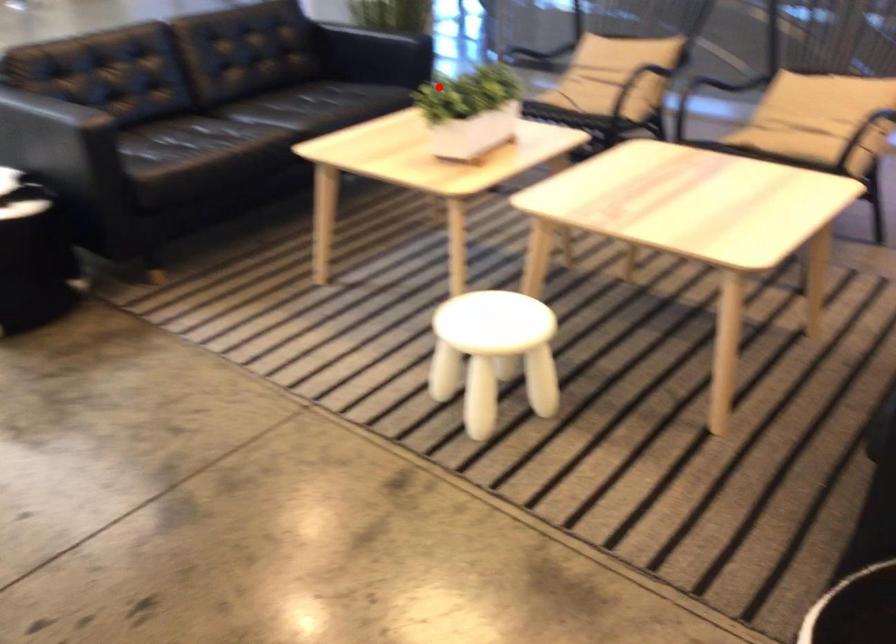
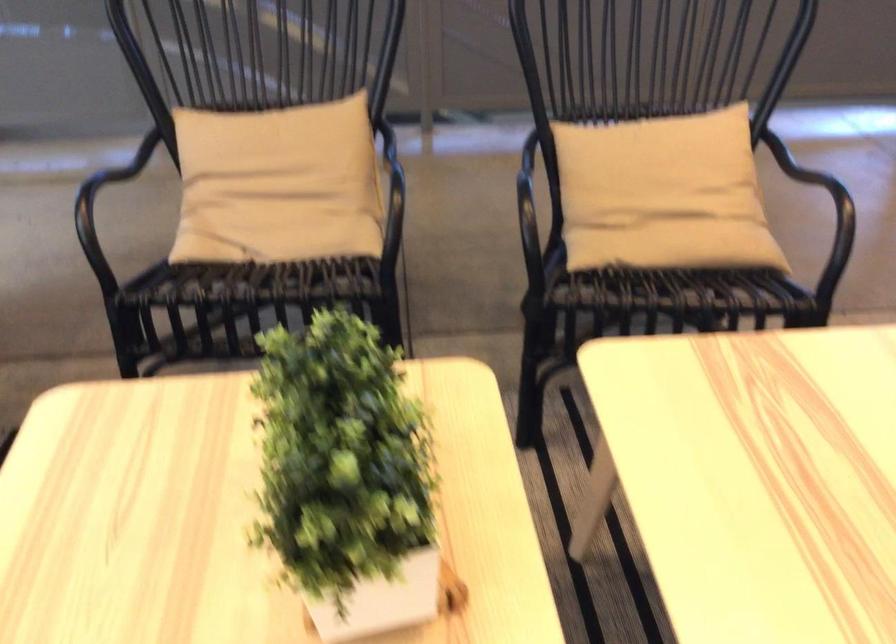
In the second image, find the point that corresponds to the highlighted location in the first image.

(346, 477)